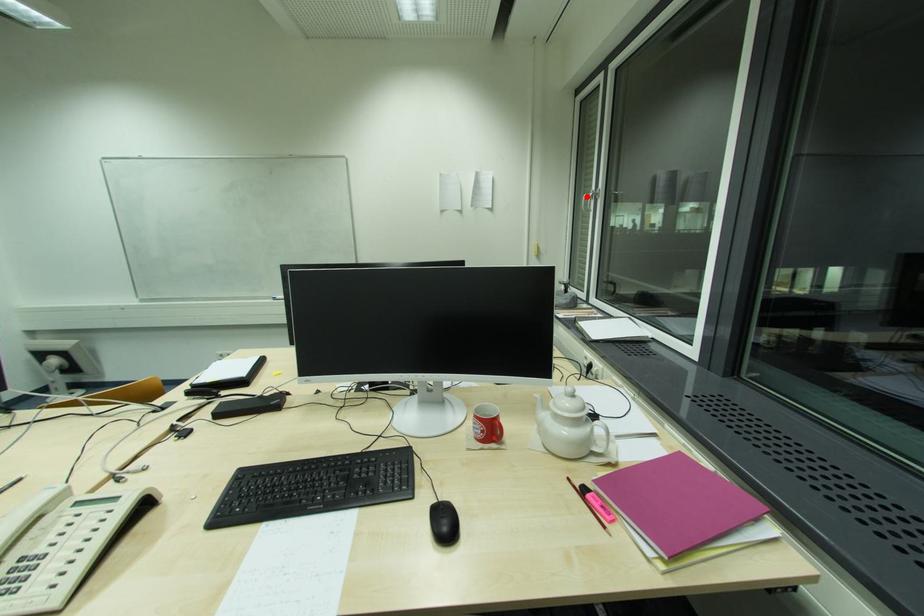
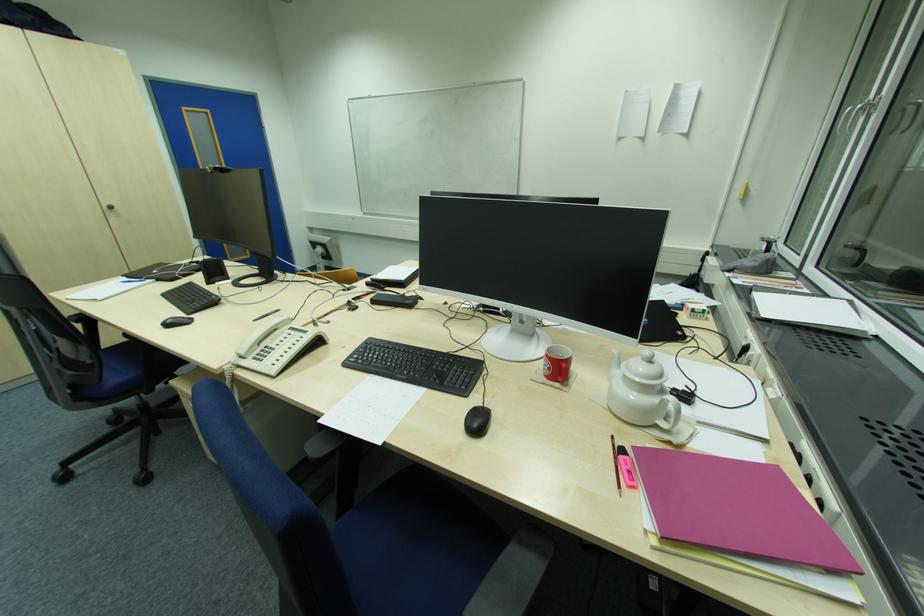
Locate, in the second image, the point that corresponds to the highlighted location in the first image.

(850, 111)